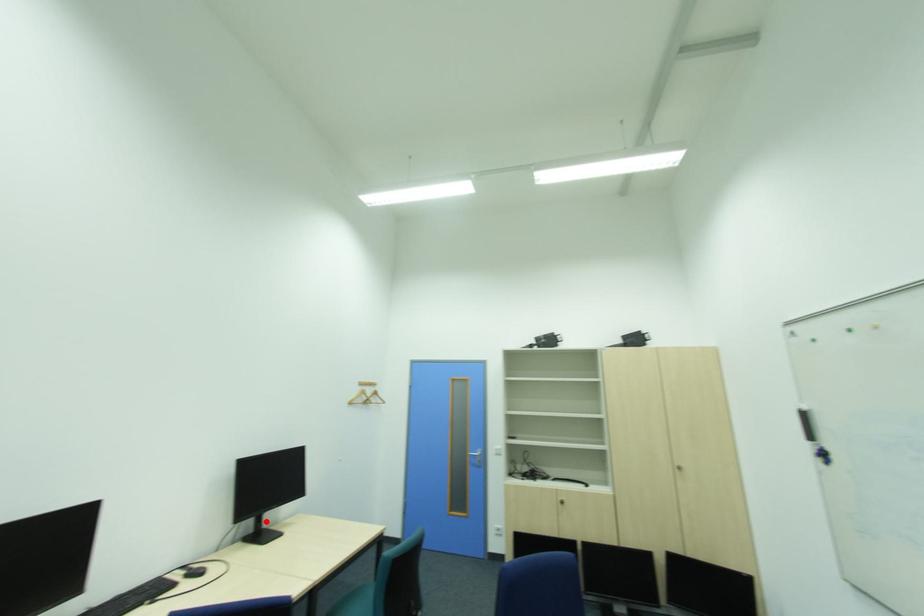
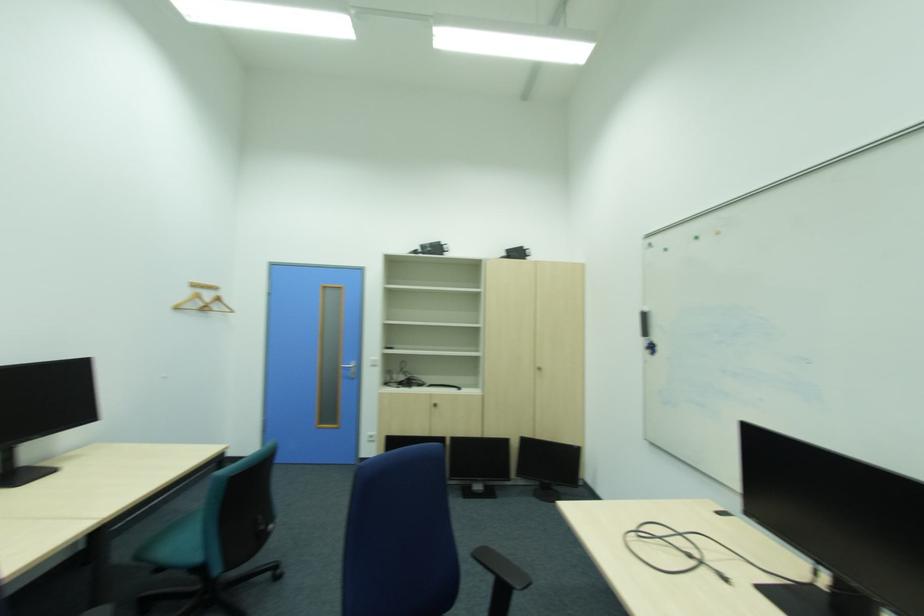
Question: I am providing you with two images of the same scene from different viewpoints. A red point is marked on the first image. Is the red point's position out of view in image 2?

Choices:
 (A) Yes
 (B) No

Answer: (B)